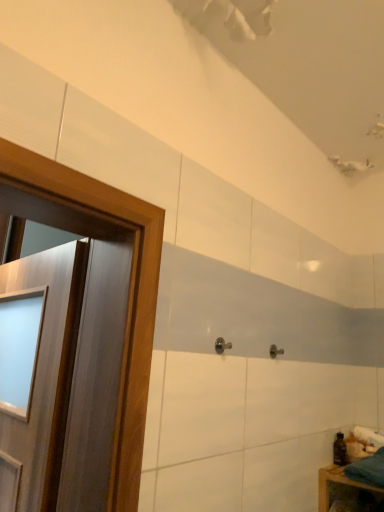
Question: Are wooden door at left and satin nickel door handle at center far apart?

Choices:
 (A) yes
 (B) no

Answer: (B)

Question: Are wooden door at left and satin nickel door handle at center making contact?

Choices:
 (A) yes
 (B) no

Answer: (B)

Question: Does wooden door at left come behind satin nickel door handle at center?

Choices:
 (A) yes
 (B) no

Answer: (B)

Question: Is wooden door at left at the right side of satin nickel door handle at center?

Choices:
 (A) yes
 (B) no

Answer: (B)

Question: From a real-world perspective, is wooden door at left below satin nickel door handle at center?

Choices:
 (A) no
 (B) yes

Answer: (B)

Question: Can you confirm if wooden door at left is thinner than satin nickel door handle at center?

Choices:
 (A) yes
 (B) no

Answer: (B)

Question: Considering the relative sizes of transparent plastic bottle at lower right and satin nickel door handle at center in the image provided, is transparent plastic bottle at lower right bigger than satin nickel door handle at center?

Choices:
 (A) no
 (B) yes

Answer: (B)

Question: Could you tell me if transparent plastic bottle at lower right is facing satin nickel door handle at center?

Choices:
 (A) yes
 (B) no

Answer: (A)

Question: Does transparent plastic bottle at lower right appear on the left side of satin nickel door handle at center?

Choices:
 (A) no
 (B) yes

Answer: (A)

Question: Is transparent plastic bottle at lower right surrounding satin nickel door handle at center?

Choices:
 (A) yes
 (B) no

Answer: (B)

Question: Can you confirm if transparent plastic bottle at lower right is shorter than satin nickel door handle at center?

Choices:
 (A) yes
 (B) no

Answer: (B)

Question: Can you confirm if transparent plastic bottle at lower right is smaller than satin nickel door handle at center?

Choices:
 (A) no
 (B) yes

Answer: (A)

Question: Is wooden door at left inside transparent plastic bottle at lower right?

Choices:
 (A) yes
 (B) no

Answer: (B)